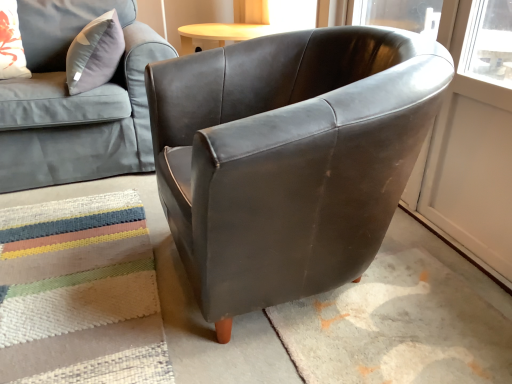
Identify the location of free point above textured woven mat at lower left (from a real-world perspective). (55, 280).